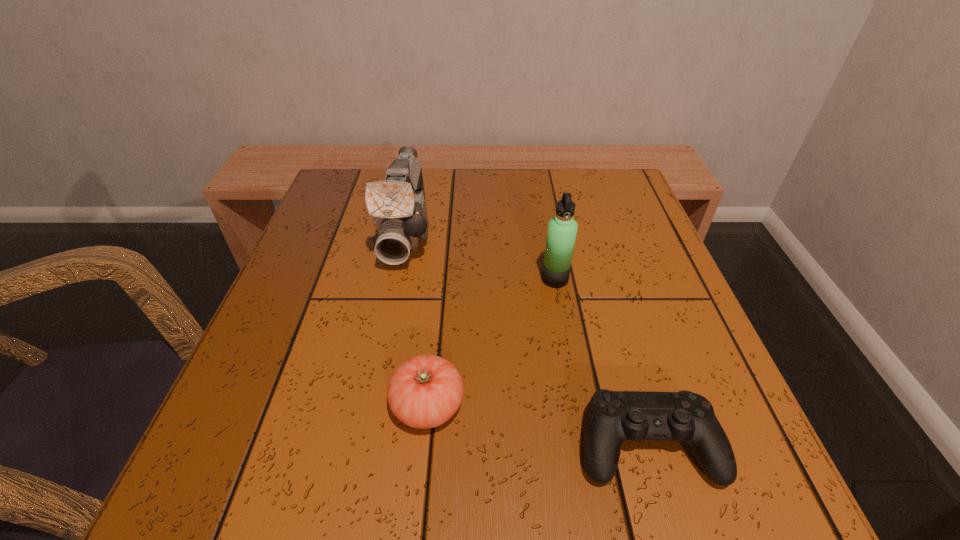
Identify the location of thermos bottle. (562, 229).

Identify the location of camcorder. (397, 204).

Find the location of a particular element. tomato is located at coordinates (x=425, y=391).

The height and width of the screenshot is (540, 960). What are the coordinates of `control` in the screenshot? It's located at (613, 417).

The height and width of the screenshot is (540, 960). Find the location of `vacant space located on the back of the thermos bottle`. vacant space located on the back of the thermos bottle is located at coordinates (548, 241).

Identify the location of vacant position located 0.240m on the front-facing side of the camcorder. The height and width of the screenshot is (540, 960). (378, 376).

Identify the location of vacant space located 0.100m on the back of the tomato. This screenshot has width=960, height=540. (436, 326).

Where is `free space located 0.080m on the left of the control`? Image resolution: width=960 pixels, height=540 pixels. free space located 0.080m on the left of the control is located at coordinates (519, 445).

Image resolution: width=960 pixels, height=540 pixels. I want to click on object at the far edge, so click(397, 204).

The height and width of the screenshot is (540, 960). I want to click on object present at the near edge, so click(613, 417).